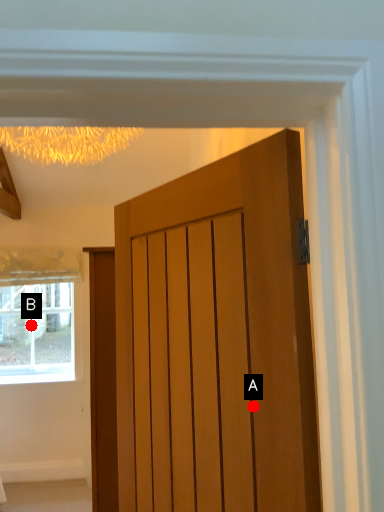
Question: Two points are circled on the image, labeled by A and B beside each circle. Which point is further to the camera?

Choices:
 (A) A is further
 (B) B is further

Answer: (B)